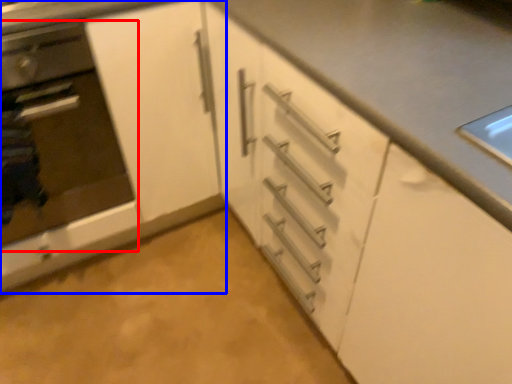
Question: Which object is closer to the camera taking this photo, oven (highlighted by a red box) or cabinetry (highlighted by a blue box)?

Choices:
 (A) oven
 (B) cabinetry

Answer: (A)